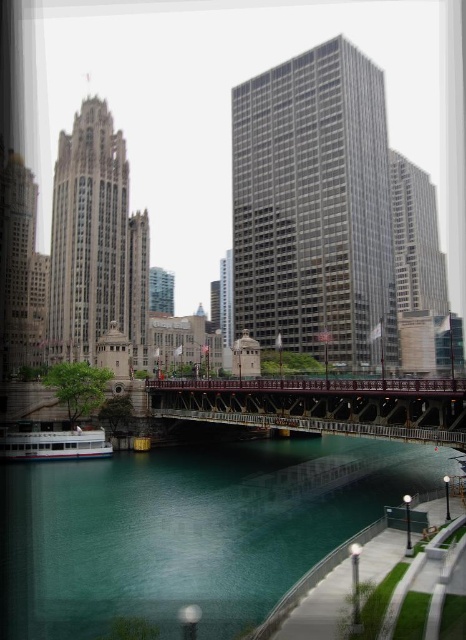
Question: Which point appears farthest from the camera in this image?

Choices:
 (A) (356, 388)
 (B) (363, 189)
 (C) (70, 449)
 (D) (83, 246)

Answer: (B)

Question: Is beige stone tower at left bigger than white matte boat at lower left?

Choices:
 (A) no
 (B) yes

Answer: (B)

Question: Which object is positioned closest to the teal glassy river at center?

Choices:
 (A) gray glass skyscraper at center
 (B) white matte boat at lower left
 (C) rustic metal bridge at center
 (D) beige stone tower at left

Answer: (C)

Question: Can you confirm if beige stone tower at left is positioned below rustic metal bridge at center?

Choices:
 (A) no
 (B) yes

Answer: (A)

Question: Which is nearer to the rustic metal bridge at center?

Choices:
 (A) teal glassy river at center
 (B) white matte boat at lower left
 (C) beige stone tower at left
 (D) gray glass skyscraper at center

Answer: (A)

Question: Can you confirm if gray glass skyscraper at center is bigger than rustic metal bridge at center?

Choices:
 (A) no
 (B) yes

Answer: (B)